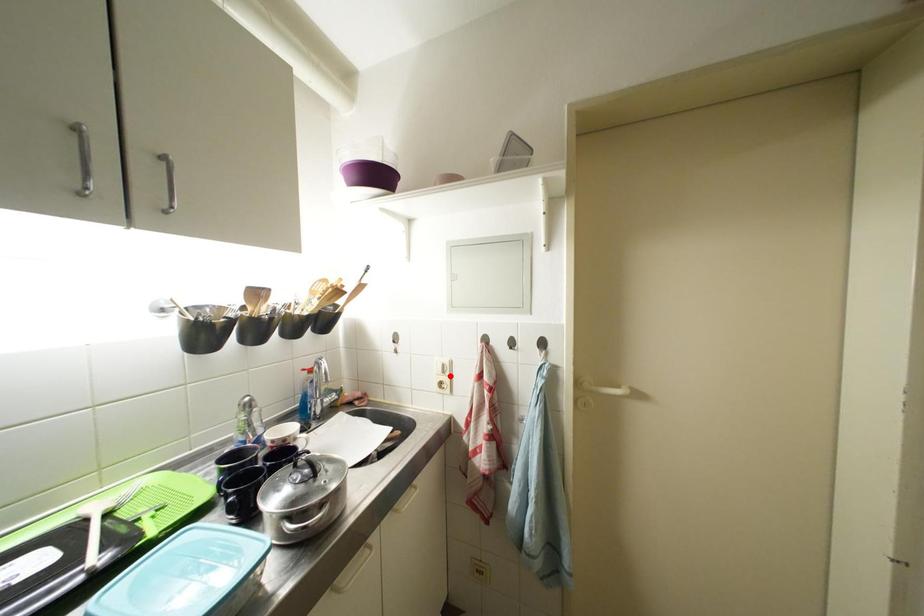
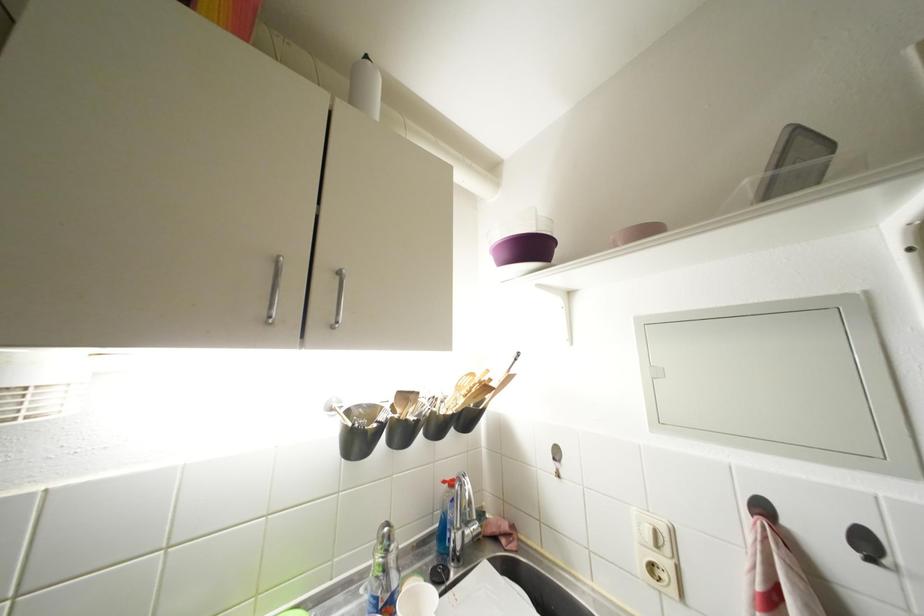
Where in the second image is the point corresponding to the highlighted location from the first image?

(663, 549)